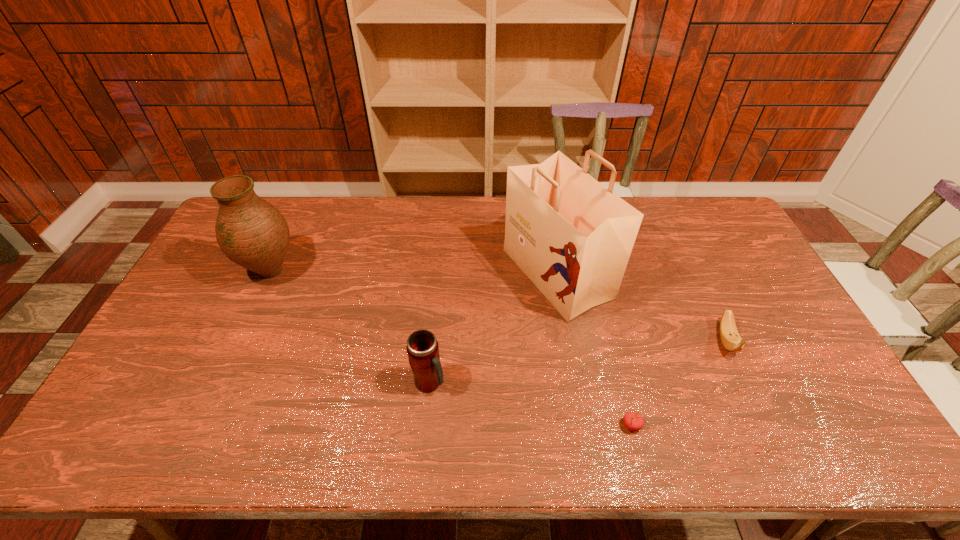
The height and width of the screenshot is (540, 960). I want to click on empty location between the vase and the tallest object, so click(414, 273).

Find the location of a particular element. The height and width of the screenshot is (540, 960). unoccupied area between the grocery bag and the banana is located at coordinates click(641, 307).

At what (x,y) coordinates should I click in order to perform the action: click on free point between the third shortest object and the fourth shortest object. Please return your answer as a coordinate pair (x, y). The height and width of the screenshot is (540, 960). Looking at the image, I should click on (350, 327).

Locate an element on the screen. vacant space that's between the vase and the rightmost object is located at coordinates (x=498, y=306).

You are a GUI agent. You are given a task and a screenshot of the screen. Output one action in this format:
    pyautogui.click(x=<x>, y=<y>)
    Task: Click on the free space that is in between the fourth farthest object and the cherry
    
    Given the screenshot: What is the action you would take?
    pyautogui.click(x=531, y=404)

In order to click on free space that is in between the nearest object and the banana in this screenshot , I will do `click(679, 382)`.

This screenshot has height=540, width=960. Identify the location of vacant area that lies between the rightmost object and the fourth farthest object. (578, 361).

You are a GUI agent. You are given a task and a screenshot of the screen. Output one action in this format:
    pyautogui.click(x=<x>, y=<y>)
    Task: Click on the free space between the grocery bag and the fourth shortest object
    The image size is (960, 540).
    Given the screenshot: What is the action you would take?
    pyautogui.click(x=414, y=273)

Where is `vacant space in between the banana and the grocery bag`? The image size is (960, 540). vacant space in between the banana and the grocery bag is located at coordinates (641, 307).

You are a GUI agent. You are given a task and a screenshot of the screen. Output one action in this format:
    pyautogui.click(x=<x>, y=<y>)
    Task: Click on the unoccupied position between the thermos bottle and the tallest object
    The image size is (960, 540).
    Given the screenshot: What is the action you would take?
    pyautogui.click(x=493, y=328)